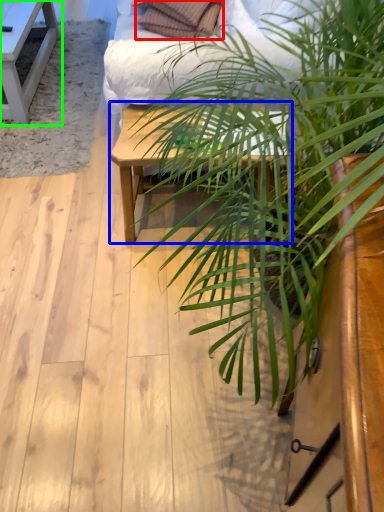
Question: Considering the real-world distances, which object is closest to pillow (highlighted by a red box)? table (highlighted by a blue box) or table (highlighted by a green box).

Choices:
 (A) table
 (B) table

Answer: (B)